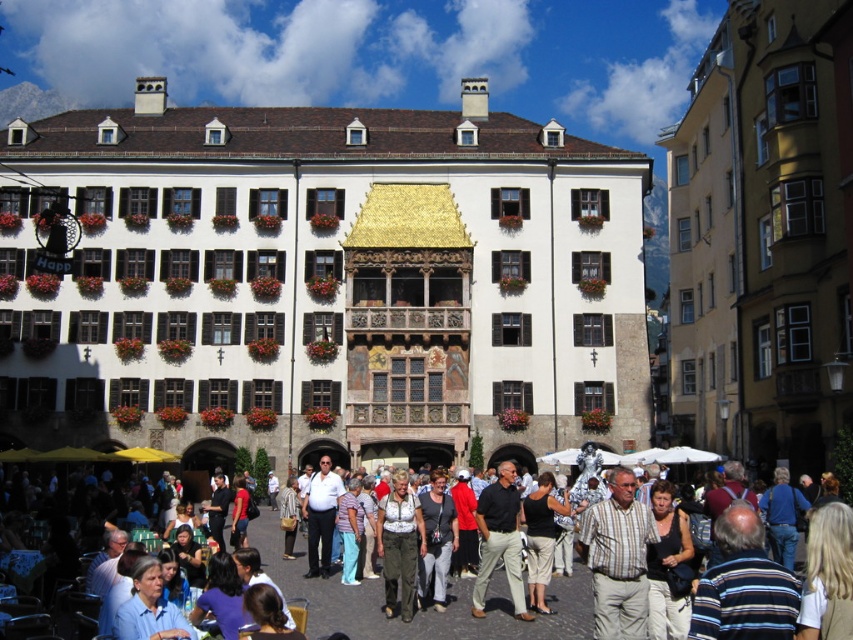
Is matte black shirt at center below black cotton shirt at center?

Indeed, matte black shirt at center is positioned under black cotton shirt at center.

Find the location of a particular element. matte black shirt at center is located at coordinates (479, 577).